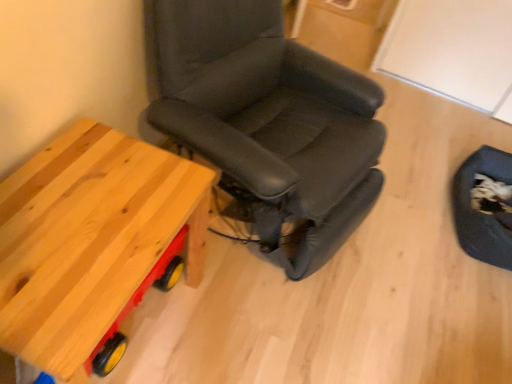
Find the location of a particular element. vacant space in between black leather chair at center and dark blue fabric swivel chair at lower right is located at coordinates (407, 235).